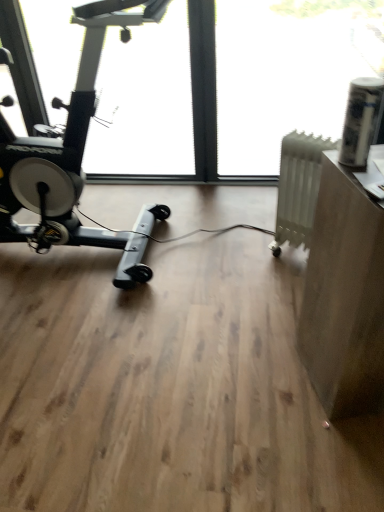
Find the location of a particular element. Image resolution: width=384 pixels, height=512 pixels. vacant location below transparent glass window at center, which is the first window screen from left to right (from a real-world perspective) is located at coordinates (170, 256).